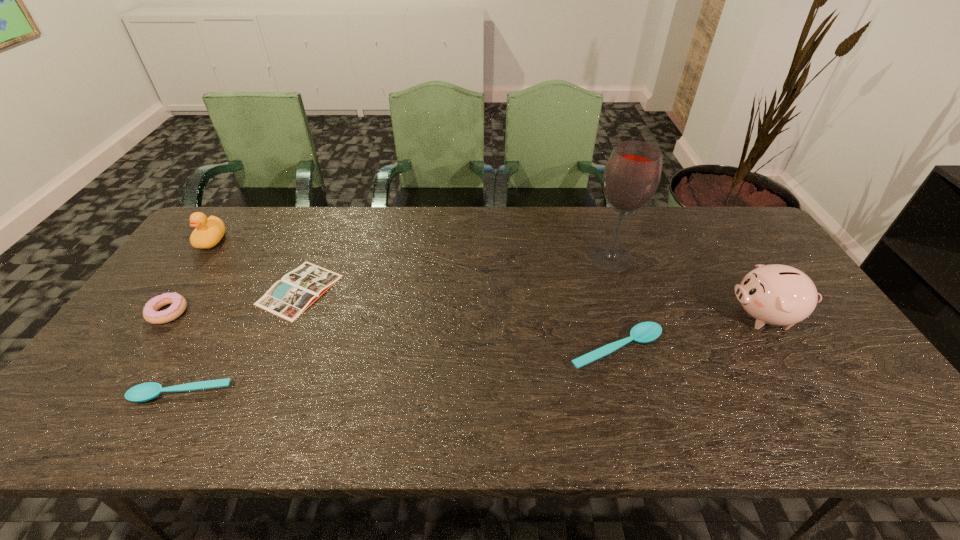
You are a GUI agent. You are given a task and a screenshot of the screen. Output one action in this format:
    pyautogui.click(x=<x>, y=<y>)
    Task: Click on the duck located in the left edge section of the desktop
    The width and height of the screenshot is (960, 540).
    Given the screenshot: What is the action you would take?
    pyautogui.click(x=209, y=231)

The width and height of the screenshot is (960, 540). Identify the location of doughnut at the left edge. (150, 314).

Image resolution: width=960 pixels, height=540 pixels. I want to click on object that is at the right edge, so click(x=775, y=294).

Identify the location of object that is at the far left corner. [209, 231].

Where is `object that is positioned at the near left corner`? Image resolution: width=960 pixels, height=540 pixels. object that is positioned at the near left corner is located at coordinates (143, 392).

The image size is (960, 540). What are the coordinates of `free space at the far edge` in the screenshot? It's located at (386, 230).

The image size is (960, 540). I want to click on vacant space at the near edge of the desktop, so click(178, 368).

This screenshot has width=960, height=540. In the image, there is a desktop. Identify the location of vacant space at the left edge. (193, 280).

This screenshot has width=960, height=540. I want to click on empty location between the right spoon and the third tallest object, so click(x=414, y=295).

This screenshot has width=960, height=540. In order to click on vacant area that lies between the fourth shortest object and the shortest object in this screenshot , I will do `click(233, 301)`.